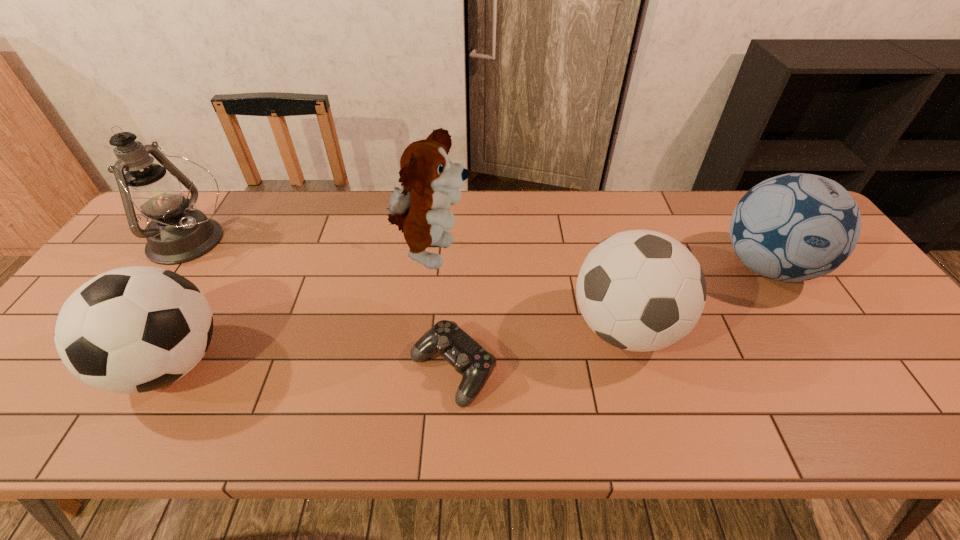
This screenshot has height=540, width=960. Identify the location of object that is at the far right corner. (794, 227).

The height and width of the screenshot is (540, 960). Identify the location of vacant space at the far edge. (738, 199).

This screenshot has height=540, width=960. I want to click on vacant area between the puppy and the shortest object, so click(x=442, y=312).

This screenshot has height=540, width=960. I want to click on vacant area that lies between the rightmost soccer ball and the leftmost soccer ball, so click(468, 315).

Where is `free space between the second soccer ball from left to right and the puppy`? The image size is (960, 540). free space between the second soccer ball from left to right and the puppy is located at coordinates (527, 291).

The width and height of the screenshot is (960, 540). Identify the location of unoccupied area between the second object from right to left and the puppy. (527, 291).

Where is `free spot between the leftmost soccer ball and the rightmost object`? This screenshot has height=540, width=960. free spot between the leftmost soccer ball and the rightmost object is located at coordinates [x=468, y=315].

Identify the location of vacant area that lies between the rightmost object and the oil lamp. (478, 254).

The image size is (960, 540). What are the coordinates of `vacant region between the leftmost soccer ball and the puppy` in the screenshot? It's located at (300, 309).

At what (x,y) coordinates should I click in order to perform the action: click on empty space between the control and the second soccer ball from right to left. Please return your answer as a coordinate pair (x, y). Looking at the image, I should click on (539, 349).